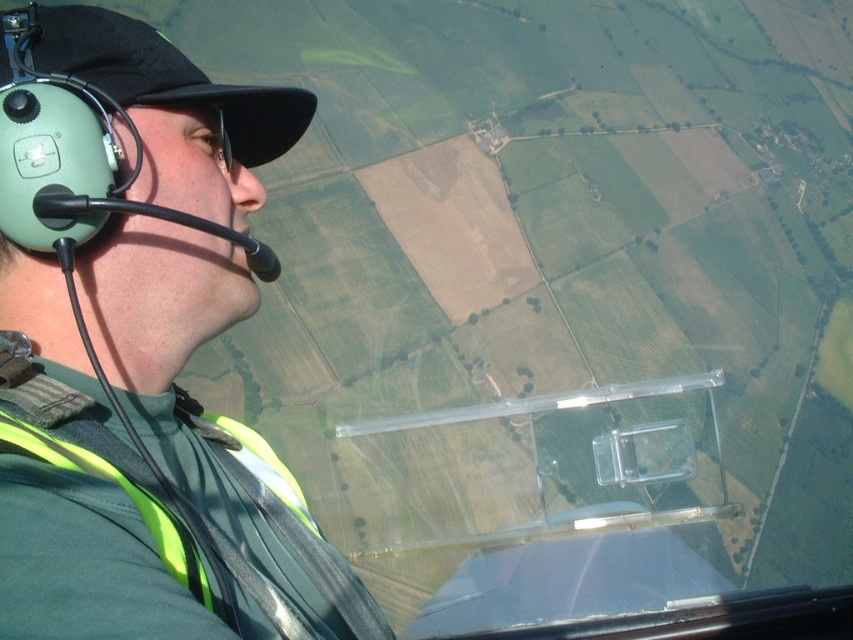
Question: Which point is closer to the camera?

Choices:
 (A) (231, 493)
 (B) (258, 532)

Answer: (B)

Question: Which point appears closest to the camera in this image?

Choices:
 (A) (177, 81)
 (B) (102, 637)

Answer: (B)

Question: From the image, what is the correct spatial relationship of green matte helmet at upper left in relation to neon yellow reflective safety vest at left?

Choices:
 (A) right
 (B) left

Answer: (A)

Question: Is green matte helmet at upper left further to the viewer compared to neon yellow reflective safety vest at left?

Choices:
 (A) no
 (B) yes

Answer: (B)

Question: Can you confirm if green matte helmet at upper left is wider than neon yellow reflective safety vest at left?

Choices:
 (A) yes
 (B) no

Answer: (A)